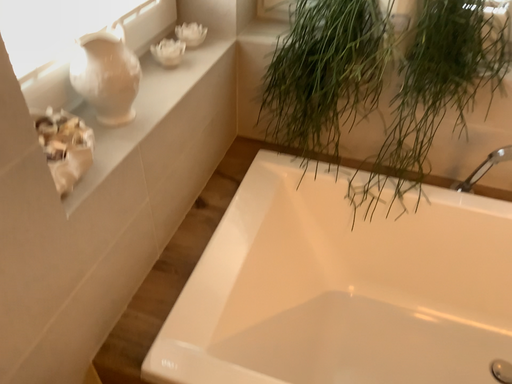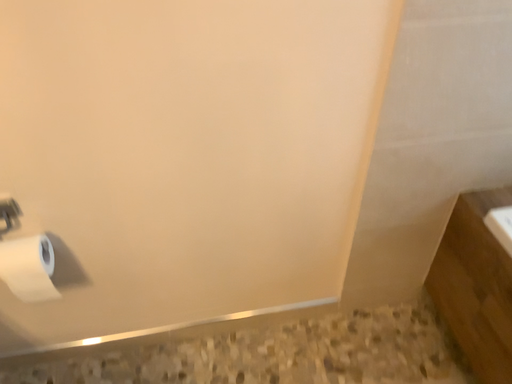
Question: Which way did the camera rotate in the video?

Choices:
 (A) rotated right
 (B) rotated left

Answer: (B)